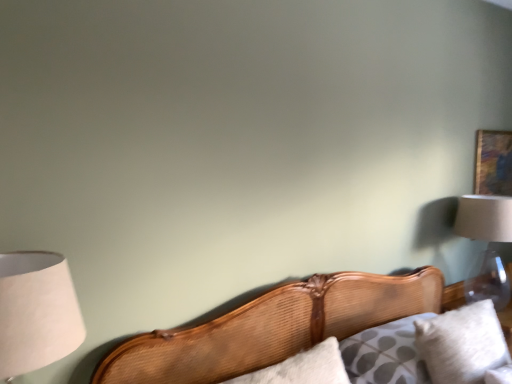
Question: From a real-world perspective, is wooden bed at center below white soft pillow at lower right?

Choices:
 (A) no
 (B) yes

Answer: (A)

Question: Considering the relative sizes of wooden bed at center and white soft pillow at lower right in the image provided, is wooden bed at center taller than white soft pillow at lower right?

Choices:
 (A) no
 (B) yes

Answer: (B)

Question: Is wooden bed at center with white soft pillow at lower right?

Choices:
 (A) no
 (B) yes

Answer: (A)

Question: Is the depth of wooden bed at center less than that of white soft pillow at lower right?

Choices:
 (A) yes
 (B) no

Answer: (A)

Question: From the image's perspective, would you say wooden bed at center is shown under white soft pillow at lower right?

Choices:
 (A) no
 (B) yes

Answer: (B)

Question: Can you confirm if wooden bed at center is shorter than white soft pillow at lower right?

Choices:
 (A) yes
 (B) no

Answer: (B)

Question: Does clear glass lampshade at upper right, the second lamp positioned from the left, have a lesser width compared to wooden cushion at lower right?

Choices:
 (A) no
 (B) yes

Answer: (B)

Question: Is clear glass lampshade at upper right, which ranks as the second lamp in front-to-back order, not within wooden cushion at lower right?

Choices:
 (A) no
 (B) yes

Answer: (B)

Question: Does clear glass lampshade at upper right, which ranks as the second lamp in front-to-back order, have a smaller size compared to wooden cushion at lower right?

Choices:
 (A) no
 (B) yes

Answer: (A)

Question: Is clear glass lampshade at upper right, positioned as the 1th lamp in right-to-left order, facing away from wooden cushion at lower right?

Choices:
 (A) yes
 (B) no

Answer: (B)

Question: Does clear glass lampshade at upper right, which appears as the 1th lamp when viewed from the back, appear on the left side of wooden cushion at lower right?

Choices:
 (A) no
 (B) yes

Answer: (A)

Question: Is clear glass lampshade at upper right, the second lamp positioned from the left, at the right side of wooden cushion at lower right?

Choices:
 (A) yes
 (B) no

Answer: (A)

Question: Does wooden cushion at lower right have a greater height compared to clear glass lampshade at upper right, positioned as the 1th lamp in right-to-left order?

Choices:
 (A) no
 (B) yes

Answer: (A)